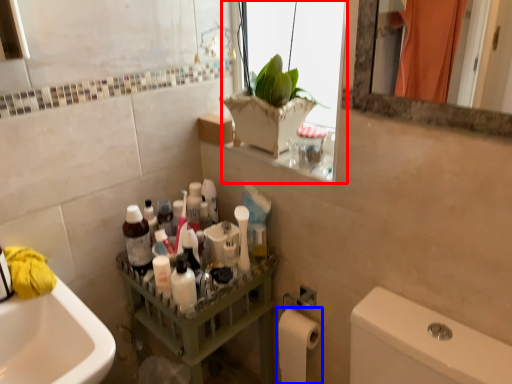
Question: Among these objects, which one is nearest to the camera, window (highlighted by a red box) or toilet paper (highlighted by a blue box)?

Choices:
 (A) window
 (B) toilet paper

Answer: (A)